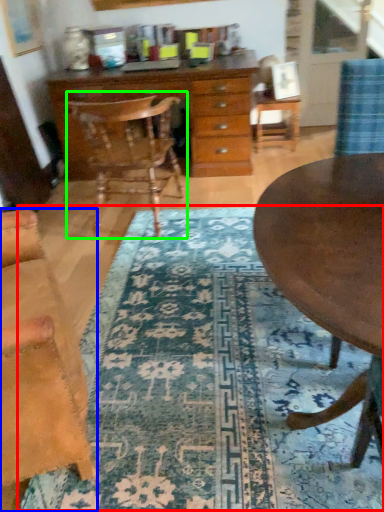
Question: Based on their relative distances, which object is farther from mat (highlighted by a red box)? Choose from chair (highlighted by a blue box) and chair (highlighted by a green box).

Choices:
 (A) chair
 (B) chair

Answer: (B)